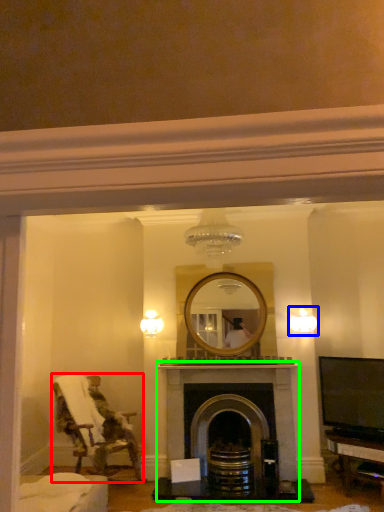
Question: Estimate the real-world distances between objects in this image. Which object is closer to chair (highlighted by a red box), light fixture (highlighted by a blue box) or fireplace (highlighted by a green box)?

Choices:
 (A) light fixture
 (B) fireplace

Answer: (B)